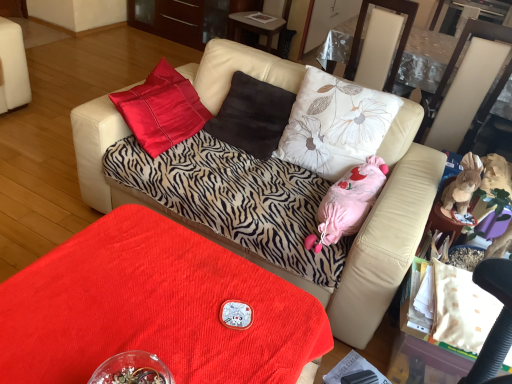
What is the approximate height of pink fabric stuffed toy at center, marked as the 2th animal in a right-to-left arrangement?

pink fabric stuffed toy at center, marked as the 2th animal in a right-to-left arrangement, is 8.10 inches in height.

Where is `pink fabric stuffed toy at center, the first animal positioned from the left`? pink fabric stuffed toy at center, the first animal positioned from the left is located at coordinates (348, 203).

Looking at this image, how much space does floral fabric pillow at center, positioned as the second pillow in left-to-right order, occupy vertically?

It is 22.03 inches.

Locate an element on the screen. brown suede pillow at center, positioned as the first pillow in left-to-right order is located at coordinates (252, 116).

Based on the photo, do you think transparent plastic glass table at upper right is within floral fabric pillow at center, positioned as the second pillow in left-to-right order, or outside of it?

transparent plastic glass table at upper right lies outside floral fabric pillow at center, positioned as the second pillow in left-to-right order.

Considering the sizes of transparent plastic glass table at upper right and floral fabric pillow at center, positioned as the second pillow in left-to-right order, in the image, is transparent plastic glass table at upper right bigger or smaller than floral fabric pillow at center, positioned as the second pillow in left-to-right order,?

Considering their sizes, transparent plastic glass table at upper right takes up more space than floral fabric pillow at center, positioned as the second pillow in left-to-right order.

Which object is closer to the camera taking this photo, transparent plastic glass table at upper right or floral fabric pillow at center, positioned as the second pillow in left-to-right order?

floral fabric pillow at center, positioned as the second pillow in left-to-right order, is closer to the camera.

Which of these two, transparent plastic glass table at upper right or floral fabric pillow at center, which is the 1th pillow in right-to-left order, stands taller?

With more height is transparent plastic glass table at upper right.

Image resolution: width=512 pixels, height=384 pixels. What are the coordinates of `the 2nd pillow in front of the glossy wood dresser at upper center, counting from the anchor's position` in the screenshot? It's located at (335, 124).

Does floral fabric pillow at center, positioned as the second pillow in left-to-right order, come behind glossy wood dresser at upper center?

That is False.

Between floral fabric pillow at center, which is the 1th pillow in right-to-left order, and glossy wood dresser at upper center, which one has smaller size?

With smaller size is floral fabric pillow at center, which is the 1th pillow in right-to-left order.

Is floral fabric pillow at center, positioned as the second pillow in left-to-right order, situated inside glossy wood dresser at upper center or outside?

floral fabric pillow at center, positioned as the second pillow in left-to-right order, is outside glossy wood dresser at upper center.

Considering the positions of objects glossy wood dresser at upper center and zebra-patterned fabric couch at center in the image provided, who is more to the right, glossy wood dresser at upper center or zebra-patterned fabric couch at center?

zebra-patterned fabric couch at center is more to the right.

Is glossy wood dresser at upper center taller or shorter than zebra-patterned fabric couch at center?

In the image, glossy wood dresser at upper center appears to be shorter than zebra-patterned fabric couch at center.

Is glossy wood dresser at upper center located outside zebra-patterned fabric couch at center?

Yes, glossy wood dresser at upper center is not within zebra-patterned fabric couch at center.

From the image's perspective, which object appears higher, glossy wood dresser at upper center or zebra-patterned fabric couch at center?

Result: glossy wood dresser at upper center is shown above in the image.

Is brown suede pillow at center, positioned as the first pillow in left-to-right order, wider than brown plush toy at right, which ranks as the second animal in left-to-right order?

Yes, brown suede pillow at center, positioned as the first pillow in left-to-right order, is wider than brown plush toy at right, which ranks as the second animal in left-to-right order.

Is brown suede pillow at center, positioned as the first pillow in left-to-right order, to the left of brown plush toy at right, which ranks as the second animal in left-to-right order, from the viewer's perspective?

Indeed, brown suede pillow at center, positioned as the first pillow in left-to-right order, is positioned on the left side of brown plush toy at right, which ranks as the second animal in left-to-right order.

Would you consider brown suede pillow at center, positioned as the first pillow in left-to-right order, to be distant from brown plush toy at right, which is the 1th animal in right-to-left order?

No, brown suede pillow at center, positioned as the first pillow in left-to-right order, is in close proximity to brown plush toy at right, which is the 1th animal in right-to-left order.

Is brown suede pillow at center, positioned as the first pillow in left-to-right order, positioned beyond the bounds of brown plush toy at right, which is the 1th animal in right-to-left order?

brown suede pillow at center, positioned as the first pillow in left-to-right order, is positioned outside brown plush toy at right, which is the 1th animal in right-to-left order.

Is glossy wood dresser at upper center far away from velvet red table at lower center?

That's right, there is a large distance between glossy wood dresser at upper center and velvet red table at lower center.

In the image, is glossy wood dresser at upper center on the left side or the right side of velvet red table at lower center?

glossy wood dresser at upper center is to the left of velvet red table at lower center.

From the picture: Considering the relative positions of glossy wood dresser at upper center and velvet red table at lower center in the image provided, is glossy wood dresser at upper center in front of velvet red table at lower center?

No, glossy wood dresser at upper center is further to the viewer.

Which of these two, brown plush toy at right, which is the 1th animal in right-to-left order, or floral fabric pillow at center, which is the 1th pillow in right-to-left order, is thinner?

With smaller width is brown plush toy at right, which is the 1th animal in right-to-left order.

Is brown plush toy at right, which is the 1th animal in right-to-left order, further to the viewer compared to floral fabric pillow at center, positioned as the second pillow in left-to-right order?

Yes, the depth of brown plush toy at right, which is the 1th animal in right-to-left order, is greater than that of floral fabric pillow at center, positioned as the second pillow in left-to-right order.

From a real-world perspective, is brown plush toy at right, which is the 1th animal in right-to-left order, positioned above or below floral fabric pillow at center, which is the 1th pillow in right-to-left order?

brown plush toy at right, which is the 1th animal in right-to-left order, is below floral fabric pillow at center, which is the 1th pillow in right-to-left order.

What's the angular difference between glossy wood dresser at upper center and brown plush toy at right, which ranks as the second animal in left-to-right order,'s facing directions?

They differ by 90 degrees in their facing directions.

Would you say glossy wood dresser at upper center is outside brown plush toy at right, which is the 1th animal in right-to-left order?

Yes, glossy wood dresser at upper center is located beyond the bounds of brown plush toy at right, which is the 1th animal in right-to-left order.

From their relative heights in the image, would you say glossy wood dresser at upper center is taller or shorter than brown plush toy at right, which ranks as the second animal in left-to-right order?

Considering their sizes, glossy wood dresser at upper center has more height than brown plush toy at right, which ranks as the second animal in left-to-right order.

Would you say glossy wood dresser at upper center is a long distance from brown plush toy at right, which ranks as the second animal in left-to-right order?

Indeed, glossy wood dresser at upper center is not near brown plush toy at right, which ranks as the second animal in left-to-right order.

From the transparent plastic glass table at upper right, count 2nd pillows forward and point to it. Please provide its 2D coordinates.

[(335, 124)]

Identify the location of dresser that appears below the floral fabric pillow at center, which is the 1th pillow in right-to-left order (from a real-world perspective). This screenshot has width=512, height=384. (187, 18).

Based on their spatial positions, is transparent plastic glass table at upper right or velvet red table at lower center further from floral fabric pillow at center, which is the 1th pillow in right-to-left order?

The object further to floral fabric pillow at center, which is the 1th pillow in right-to-left order, is transparent plastic glass table at upper right.

Which object lies nearer to the anchor point velvet red table at lower center, brown plush toy at right, which ranks as the second animal in left-to-right order, or transparent plastic glass table at upper right?

brown plush toy at right, which ranks as the second animal in left-to-right order, is closer to velvet red table at lower center.

When comparing their distances from transparent plastic glass table at upper right, does brown suede pillow at center, positioned as the first pillow in left-to-right order, or brown plush toy at right, which ranks as the second animal in left-to-right order, seem closer?

Among the two, brown plush toy at right, which ranks as the second animal in left-to-right order, is located nearer to transparent plastic glass table at upper right.

Estimate the real-world distances between objects in this image. Which object is further from glossy wood dresser at upper center, floral fabric pillow at center, which is the 1th pillow in right-to-left order, or pink fabric stuffed toy at center, marked as the 2th animal in a right-to-left arrangement?

Among the two, pink fabric stuffed toy at center, marked as the 2th animal in a right-to-left arrangement, is located further to glossy wood dresser at upper center.

Considering their positions, is brown suede pillow at center, positioned as the first pillow in left-to-right order, positioned closer to glossy wood dresser at upper center than beige leather swivel chair at right?

Among the two, beige leather swivel chair at right is located nearer to glossy wood dresser at upper center.

Based on their spatial positions, is beige leather swivel chair at right or brown plush toy at right, which is the 1th animal in right-to-left order, closer to glossy wood dresser at upper center?

Among the two, beige leather swivel chair at right is located nearer to glossy wood dresser at upper center.

Based on their spatial positions, is brown suede pillow at center, which appears as the second pillow when viewed from the right, or transparent plastic glass table at upper right further from brown plush toy at right, which ranks as the second animal in left-to-right order?

transparent plastic glass table at upper right.

Looking at this image, from the image, which object appears to be nearer to zebra-patterned fabric couch at center, velvet red table at lower center or pink fabric stuffed toy at center, marked as the 2th animal in a right-to-left arrangement?

pink fabric stuffed toy at center, marked as the 2th animal in a right-to-left arrangement, lies closer to zebra-patterned fabric couch at center than the other object.

Where is `pillow between brown suede pillow at center, which appears as the second pillow when viewed from the right, and pink fabric stuffed toy at center, the first animal positioned from the left, in the horizontal direction`? pillow between brown suede pillow at center, which appears as the second pillow when viewed from the right, and pink fabric stuffed toy at center, the first animal positioned from the left, in the horizontal direction is located at coordinates (335, 124).

Locate an element on the screen. This screenshot has height=384, width=512. studio couch between velvet red table at lower center and beige leather swivel chair at right from left to right is located at coordinates (354, 240).

Find the location of a particular element. pillow between zebra-patterned fabric couch at center and beige leather swivel chair at right in the horizontal direction is located at coordinates (335, 124).

Locate an element on the screen. animal between floral fabric pillow at center, positioned as the second pillow in left-to-right order, and glossy wood dresser at upper center in the front-back direction is located at coordinates (463, 185).